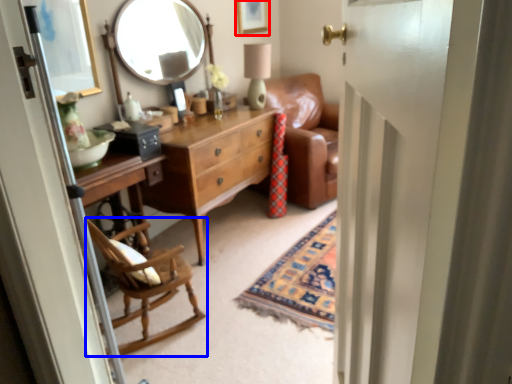
Question: Which point is further to the camera, picture frame (highlighted by a red box) or chair (highlighted by a blue box)?

Choices:
 (A) picture frame
 (B) chair

Answer: (A)